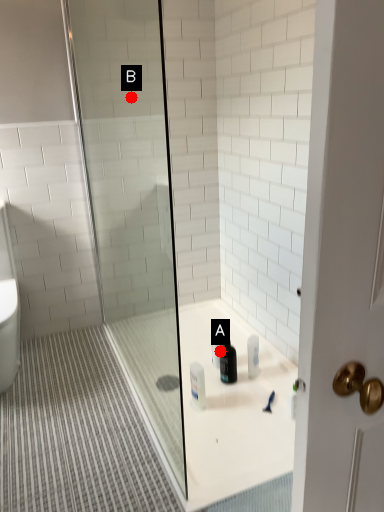
Question: Two points are circled on the image, labeled by A and B beside each circle. Which point is farther from the camera taking this photo?

Choices:
 (A) A is further
 (B) B is further

Answer: (B)